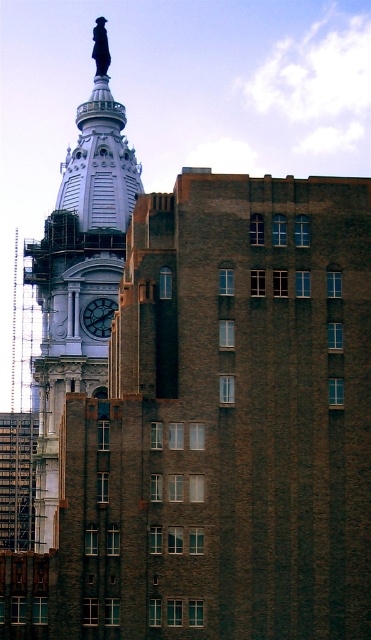
Question: Which point is farther from the camera taking this photo?

Choices:
 (A) (107, 145)
 (B) (89, 308)

Answer: (A)

Question: Is white stone clock tower at upper left below dark brown wooden clock at center-left?

Choices:
 (A) yes
 (B) no

Answer: (A)

Question: Can you confirm if white stone clock tower at upper left is positioned to the right of dark brown wooden clock at center-left?

Choices:
 (A) no
 (B) yes

Answer: (A)

Question: Can you confirm if white stone clock tower at upper left is positioned to the right of dark brown wooden clock at center-left?

Choices:
 (A) yes
 (B) no

Answer: (B)

Question: Which point is farther to the camera?

Choices:
 (A) (99, 337)
 (B) (79, 372)

Answer: (A)